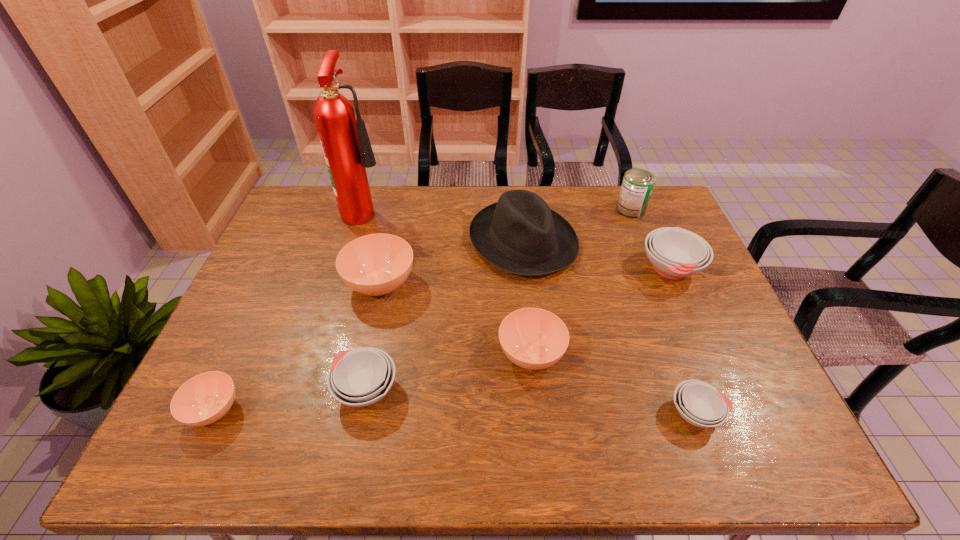
Where is `the tallest object`? The image size is (960, 540). the tallest object is located at coordinates (345, 142).

This screenshot has height=540, width=960. I want to click on red fire extinguisher, so click(x=345, y=142).

I want to click on gray fedora, so click(520, 234).

Identify the location of can. Image resolution: width=960 pixels, height=540 pixels. (637, 185).

At what (x,y) coordinates should I click in order to perform the action: click on the second peach soup bowl from right to left. Please return your answer as a coordinate pair (x, y). Looking at the image, I should click on (377, 264).

I want to click on the farthest peach soup bowl, so click(377, 264).

Locate an element on the screen. The image size is (960, 540). the biggest white soup bowl is located at coordinates (675, 253).

Identify the location of the rightmost peach soup bowl. Image resolution: width=960 pixels, height=540 pixels. (532, 338).

Where is `the second smallest peach soup bowl`? the second smallest peach soup bowl is located at coordinates (532, 338).

Where is `the second smallest white soup bowl`? The image size is (960, 540). the second smallest white soup bowl is located at coordinates (361, 377).